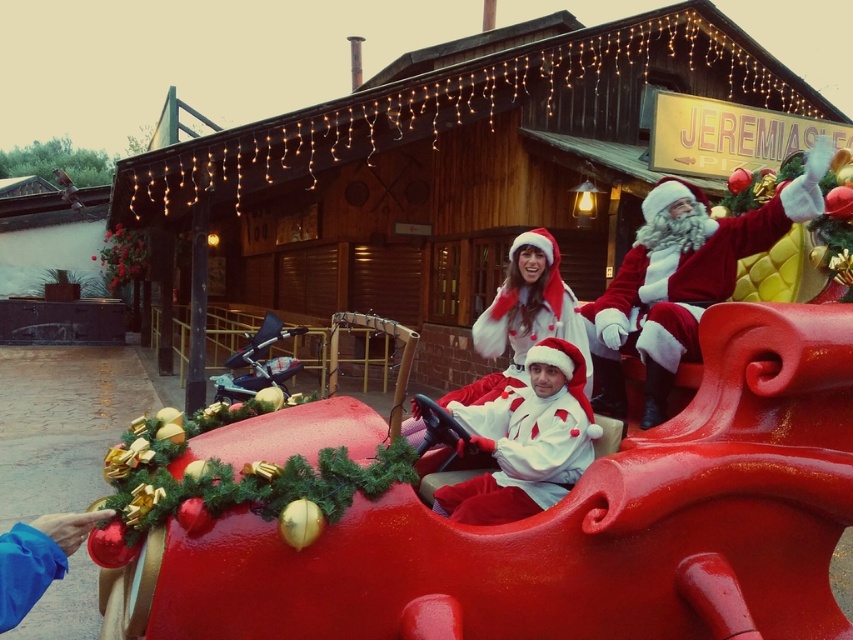
Between velvet red santa at upper right and matte white santa at center, which one appears on the right side from the viewer's perspective?

velvet red santa at upper right is more to the right.

Does velvet red santa at upper right appear under matte white santa at center?

Actually, velvet red santa at upper right is above matte white santa at center.

Measure the distance between velvet red santa at upper right and camera.

9.72 feet

Where is `velvet red santa at upper right`? The height and width of the screenshot is (640, 853). velvet red santa at upper right is located at coordinates (682, 280).